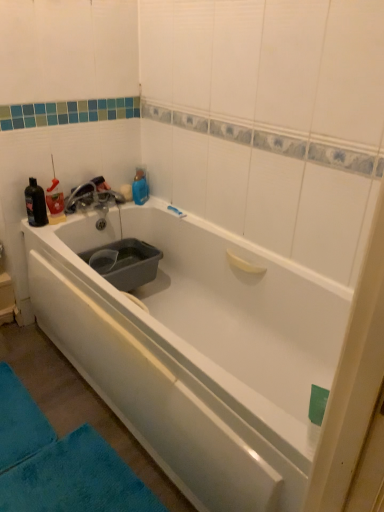
Question: From a real-world perspective, is black matte bottle at upper left, placed as the 1th bottle when sorted from left to right, located beneath gray plastic basin at left?

Choices:
 (A) no
 (B) yes

Answer: (A)

Question: Could you tell me if black matte bottle at upper left, placed as the 1th bottle when sorted from left to right, is turned towards gray plastic basin at left?

Choices:
 (A) yes
 (B) no

Answer: (B)

Question: Is black matte bottle at upper left, placed as the 1th bottle when sorted from left to right, positioned with its back to gray plastic basin at left?

Choices:
 (A) no
 (B) yes

Answer: (A)

Question: Could gray plastic basin at left be considered to be inside black matte bottle at upper left, positioned as the 2th bottle in right-to-left order?

Choices:
 (A) yes
 (B) no

Answer: (B)

Question: Is black matte bottle at upper left, placed as the 1th bottle when sorted from left to right, outside of gray plastic basin at left?

Choices:
 (A) yes
 (B) no

Answer: (A)

Question: Does black matte bottle at upper left, positioned as the 2th bottle in right-to-left order, have a larger size compared to gray plastic basin at left?

Choices:
 (A) no
 (B) yes

Answer: (A)

Question: Is gray plastic basin at left taller than white glossy bathtub at center?

Choices:
 (A) no
 (B) yes

Answer: (B)

Question: Is gray plastic basin at left to the right of white glossy bathtub at center from the viewer's perspective?

Choices:
 (A) yes
 (B) no

Answer: (B)

Question: Can you confirm if gray plastic basin at left is positioned to the left of white glossy bathtub at center?

Choices:
 (A) no
 (B) yes

Answer: (B)

Question: Would you consider gray plastic basin at left to be distant from white glossy bathtub at center?

Choices:
 (A) no
 (B) yes

Answer: (A)

Question: Is gray plastic basin at left in front of white glossy bathtub at center?

Choices:
 (A) yes
 (B) no

Answer: (B)

Question: Does gray plastic basin at left turn towards white glossy bathtub at center?

Choices:
 (A) yes
 (B) no

Answer: (B)

Question: Is black matte bottle at upper left, placed as the 1th bottle when sorted from left to right, to the left of matte silver faucet at upper left from the viewer's perspective?

Choices:
 (A) yes
 (B) no

Answer: (A)